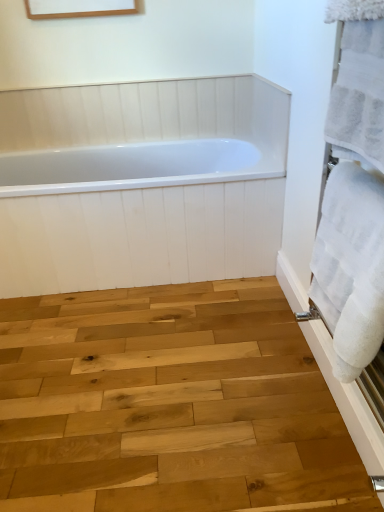
Question: Is white soft towel at right, which is the 2th bath towel from top to bottom, positioned with its back to white glossy bathtub at center?

Choices:
 (A) no
 (B) yes

Answer: (A)

Question: From the image's perspective, would you say white soft towel at right, which is the 2th bath towel from top to bottom, is shown under white glossy bathtub at center?

Choices:
 (A) no
 (B) yes

Answer: (B)

Question: Can we say white soft towel at right, arranged as the first bath towel when ordered from the bottom, lies outside white glossy bathtub at center?

Choices:
 (A) no
 (B) yes

Answer: (B)

Question: Is white soft towel at right, arranged as the first bath towel when ordered from the bottom, further to the viewer compared to white glossy bathtub at center?

Choices:
 (A) yes
 (B) no

Answer: (B)

Question: From a real-world perspective, is white soft towel at right, which is the 2th bath towel from top to bottom, located beneath white glossy bathtub at center?

Choices:
 (A) yes
 (B) no

Answer: (B)

Question: Is white soft towel at right, arranged as the first bath towel when ordered from the bottom, taller than white glossy bathtub at center?

Choices:
 (A) yes
 (B) no

Answer: (B)

Question: Can you confirm if white glossy bathtub at center is thinner than white soft towel at right, which is the 2th bath towel from top to bottom?

Choices:
 (A) no
 (B) yes

Answer: (A)

Question: Does white glossy bathtub at center turn towards white soft towel at right, arranged as the first bath towel when ordered from the bottom?

Choices:
 (A) yes
 (B) no

Answer: (A)

Question: From a real-world perspective, is white glossy bathtub at center over white soft towel at right, which is the 2th bath towel from top to bottom?

Choices:
 (A) no
 (B) yes

Answer: (A)

Question: Is white glossy bathtub at center not inside white soft towel at right, arranged as the first bath towel when ordered from the bottom?

Choices:
 (A) no
 (B) yes

Answer: (B)

Question: Is white glossy bathtub at center far from white soft towel at right, arranged as the first bath towel when ordered from the bottom?

Choices:
 (A) no
 (B) yes

Answer: (B)

Question: From a real-world perspective, is white glossy bathtub at center positioned under white soft towel at right, which is the 2th bath towel from top to bottom, based on gravity?

Choices:
 (A) no
 (B) yes

Answer: (B)

Question: From a real-world perspective, does natural wood plank at center stand above white fluffy towel at right, the 2th bath towel positioned from the bottom?

Choices:
 (A) no
 (B) yes

Answer: (A)